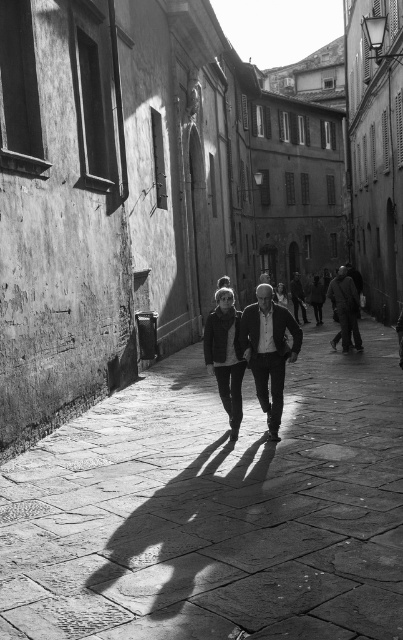
You are standing in the old European town street shown in the image. You notice the smooth stone pavement at center and the matte black jacket at center. Which object is closer to the ground?

The smooth stone pavement at center is below matte black jacket at center, so the smooth stone pavement at center is closer to the ground.

You are standing at the entrance of the street and want to walk to the smooth stone pavement at center. According to the image, in which direction should you move relative to your current position?

The smooth stone pavement at center is located at coordinates point (214, 509), so you should move forward and slightly to the right to reach it.

You are a photographer trying to capture two black jackets hanging on a rack in the center of the street. The rack can only hold items that are no wider than 40 cm. According to the scene description, can both the smooth black jacket at center and the matte black jacket at center fit on the rack without overlapping?

The smooth black jacket at center might be wider than matte black jacket at center, so it is uncertain if both can fit on the 40 cm rack without overlapping. The matte black jacket at center might fit, but the smooth black jacket at center could exceed the width limit.